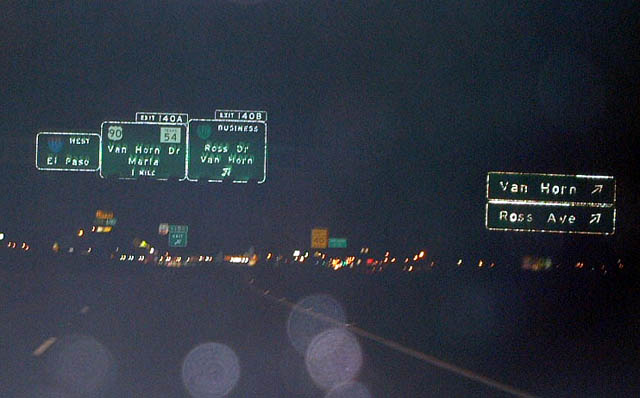
Identify the location of visible exit sign. This screenshot has height=398, width=640. (156, 115), (236, 114).